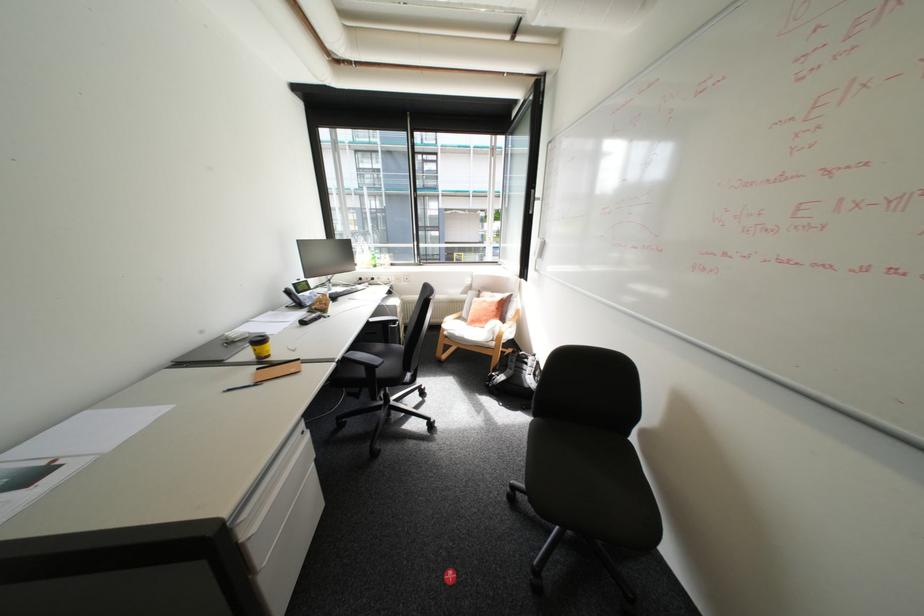
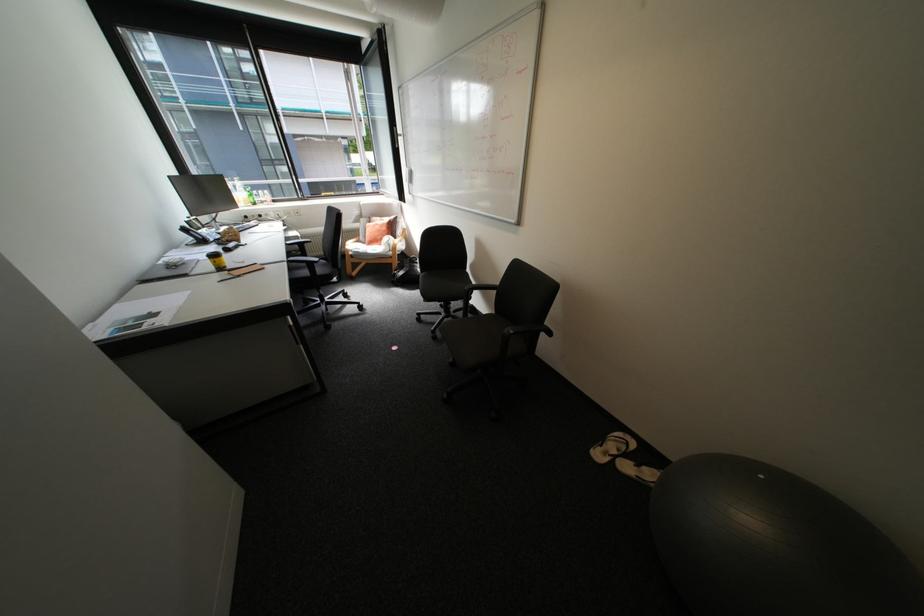
Locate, in the second image, the point that corresponds to the point at 237,333 in the first image.

(176, 260)